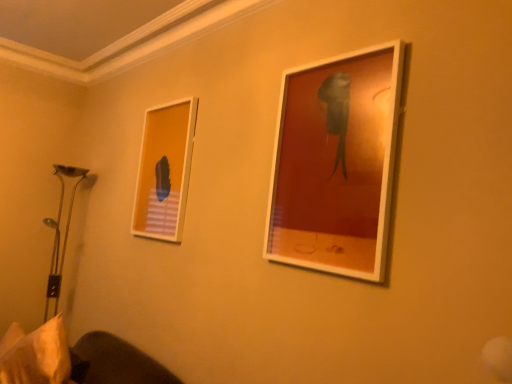
Question: From a real-world perspective, is white fabric pillow at lower left physically above matte white picture frame at upper right, marked as the first picture frame in a front-to-back arrangement?

Choices:
 (A) no
 (B) yes

Answer: (A)

Question: Can we say white fabric pillow at lower left lies outside matte white picture frame at upper right, which appears as the second picture frame when viewed from the back?

Choices:
 (A) yes
 (B) no

Answer: (A)

Question: Is white fabric pillow at lower left positioned with its back to matte white picture frame at upper right, which appears as the second picture frame when viewed from the back?

Choices:
 (A) yes
 (B) no

Answer: (B)

Question: Is white fabric pillow at lower left taller than matte white picture frame at upper right, marked as the first picture frame in a front-to-back arrangement?

Choices:
 (A) no
 (B) yes

Answer: (A)

Question: Is the position of white fabric pillow at lower left more distant than that of matte white picture frame at upper right, which appears as the second picture frame when viewed from the back?

Choices:
 (A) yes
 (B) no

Answer: (A)

Question: Does white fabric pillow at lower left have a smaller size compared to matte white picture frame at upper right, marked as the first picture frame in a right-to-left arrangement?

Choices:
 (A) no
 (B) yes

Answer: (A)

Question: Does matte white picture frame at upper right, positioned as the second picture frame in left-to-right order, come in front of white fabric pillow at lower left?

Choices:
 (A) no
 (B) yes

Answer: (B)

Question: Considering the relative positions of matte white picture frame at upper right, positioned as the second picture frame in left-to-right order, and white fabric pillow at lower left in the image provided, is matte white picture frame at upper right, positioned as the second picture frame in left-to-right order, to the left of white fabric pillow at lower left from the viewer's perspective?

Choices:
 (A) no
 (B) yes

Answer: (A)

Question: Is matte white picture frame at upper right, which appears as the second picture frame when viewed from the back, completely or partially outside of white fabric pillow at lower left?

Choices:
 (A) no
 (B) yes

Answer: (B)

Question: From the image's perspective, is matte white picture frame at upper right, marked as the first picture frame in a right-to-left arrangement, on white fabric pillow at lower left?

Choices:
 (A) no
 (B) yes

Answer: (B)

Question: Does matte white picture frame at upper right, positioned as the second picture frame in left-to-right order, have a lesser height compared to white fabric pillow at lower left?

Choices:
 (A) no
 (B) yes

Answer: (A)

Question: From a real-world perspective, is matte white picture frame at upper right, marked as the first picture frame in a front-to-back arrangement, positioned over white fabric pillow at lower left based on gravity?

Choices:
 (A) yes
 (B) no

Answer: (A)

Question: Is matte white picture frame at upper right, which appears as the second picture frame when viewed from the back, directly adjacent to matte white picture frame at upper left, marked as the first picture frame in a left-to-right arrangement?

Choices:
 (A) yes
 (B) no

Answer: (B)